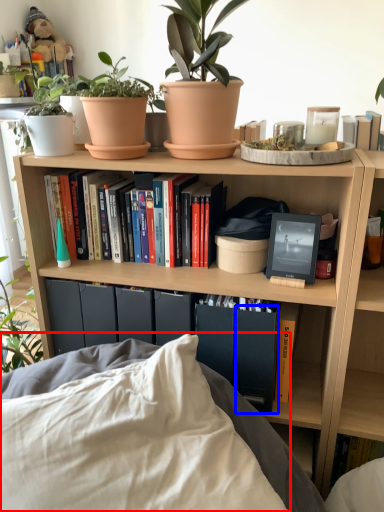
Question: Which point is closer to the camera, pillow (highlighted by a red box) or paperback book (highlighted by a blue box)?

Choices:
 (A) pillow
 (B) paperback book

Answer: (A)